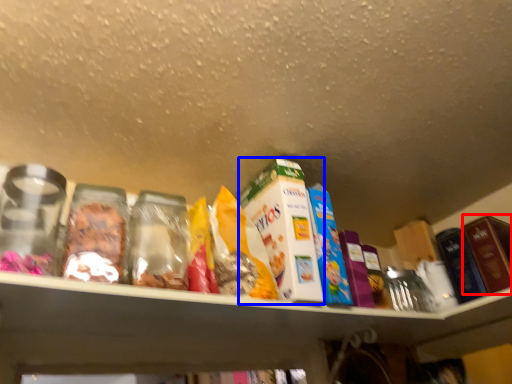
Question: Which point is further to the camera, product (highlighted by a red box) or product (highlighted by a blue box)?

Choices:
 (A) product
 (B) product

Answer: (A)